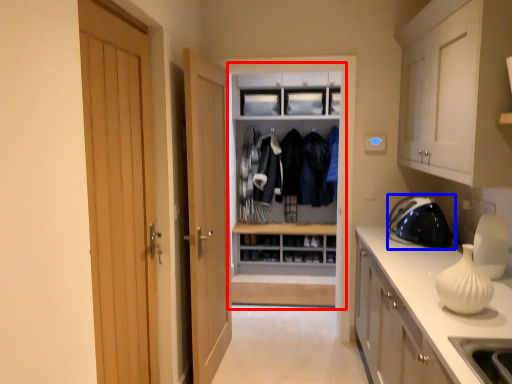
Question: Which object appears closest to the camera in this image, dresser (highlighted by a red box) or appliance (highlighted by a blue box)?

Choices:
 (A) dresser
 (B) appliance

Answer: (B)